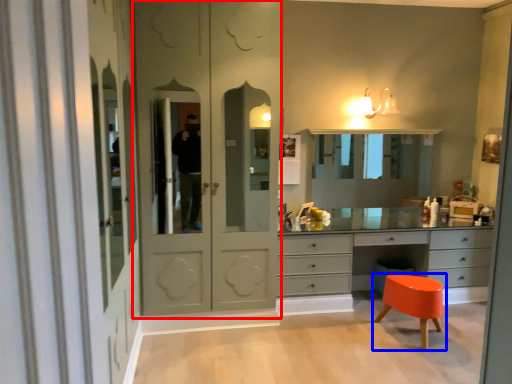
Question: Which object is further to the camera taking this photo, screen door (highlighted by a red box) or stool (highlighted by a blue box)?

Choices:
 (A) screen door
 (B) stool

Answer: (B)